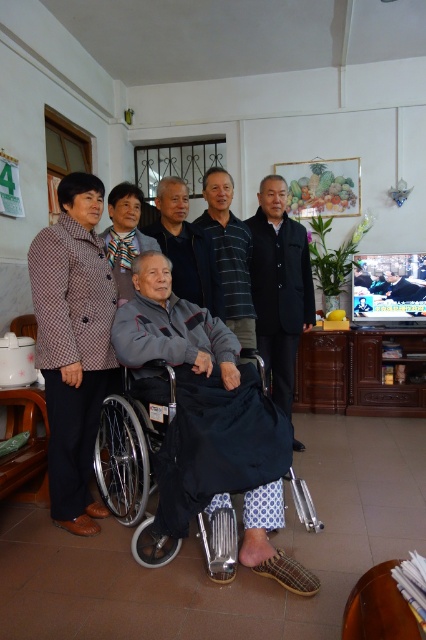
You are a photographer setting up for a group photo in the living room. You need to position the camera so that both the brown textured coat at left and the black matte suit at center are fully visible. Based on their positions, which object should be closer to the camera to ensure both are in frame?

The brown textured coat at left is in front of the black matte suit at center, so positioning the camera to have the brown textured coat at left closer will keep both in frame as the black matte suit at center is behind it.

In the scene shown: You are organizing a charity event and need to decide which coat to donate. The brown textured coat at left is larger than the striped cotton shirt at center. Which item would be more suitable for a tall person?

The brown textured coat at left is larger in size compared to the striped cotton shirt at center, making it more suitable for a tall person.

You are a delivery person holding a package that requires a signature from the recipient. You need to approach the brown textured coat at left to deliver it. Considering you are standing 2 meters away from the coat, will you be able to reach the recipient without moving closer?

The distance between you and the brown textured coat at left is 2.15 meters, which is slightly more than the 2 meters you are standing away. Therefore, you will need to move 0.15 meters closer to reach the recipient.